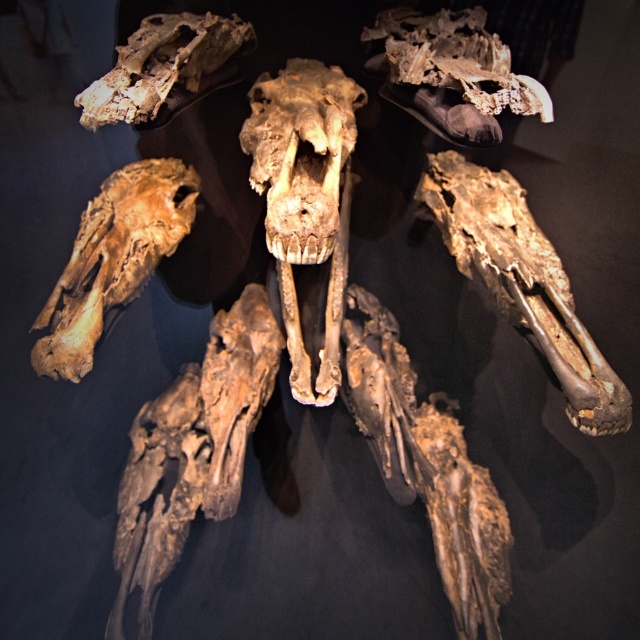
You are an archaeologist examining the fossils displayed against a dark background. You notice the brown rough bone at center and the brown fossilized skull at upper left. Which of these two objects is located to the left of the other?

A: The brown rough bone at center is positioned on the left side of brown fossilized skull at upper left.

You are an archaeologist examining the fossilized remains in the image. You notice a specific point marked at coordinates (x=113, y=259). Which object does this point correspond to?

The point at coordinates (x=113, y=259) corresponds to the brown rough bone at center.